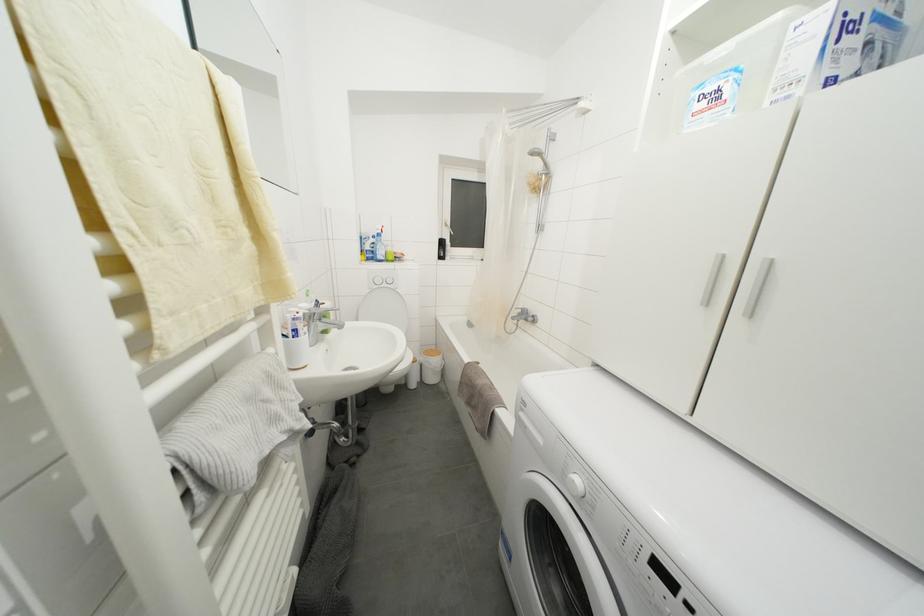
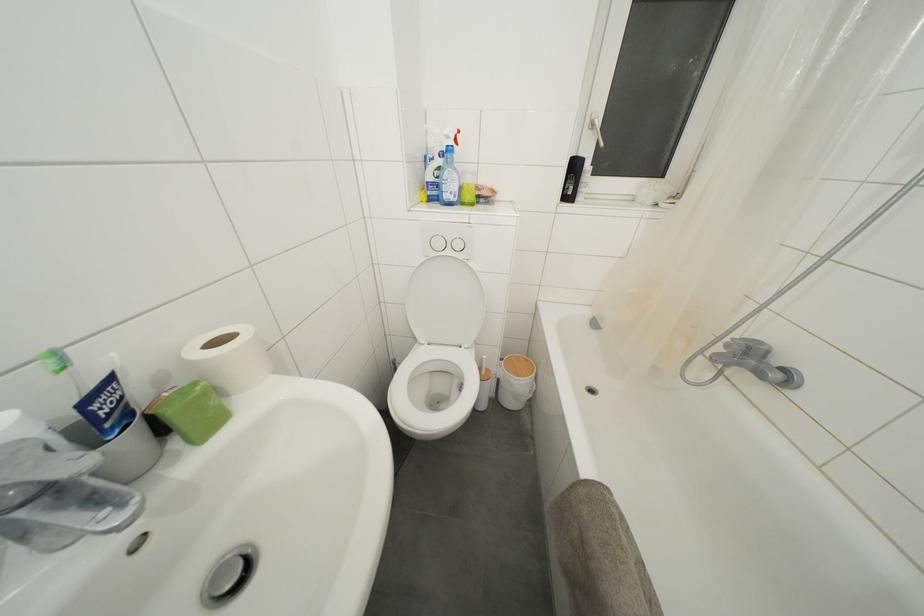
Locate, in the second image, the point that corresponds to [451,229] in the first image.

(597, 131)